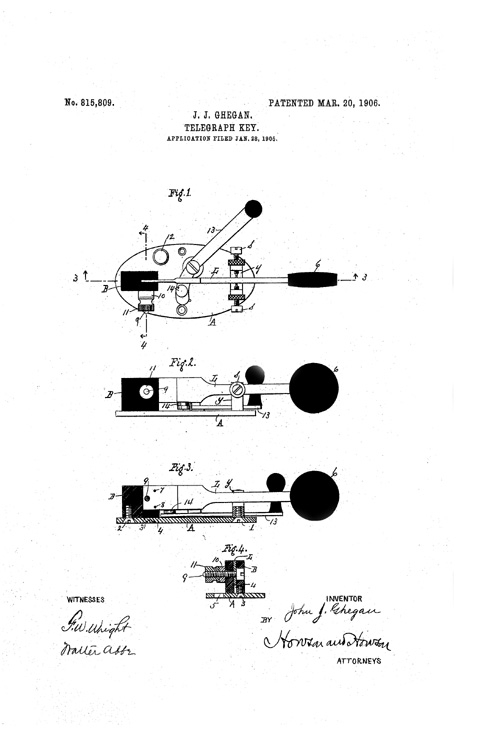
You are a GUI agent. You are given a task and a screenshot of the screen. Output one action in this format:
    pyautogui.click(x=<x>, y=<y>)
    Task: Click on the handle
    This screenshot has width=500, height=734.
    Given the screenshot: What is the action you would take?
    pyautogui.click(x=219, y=236)